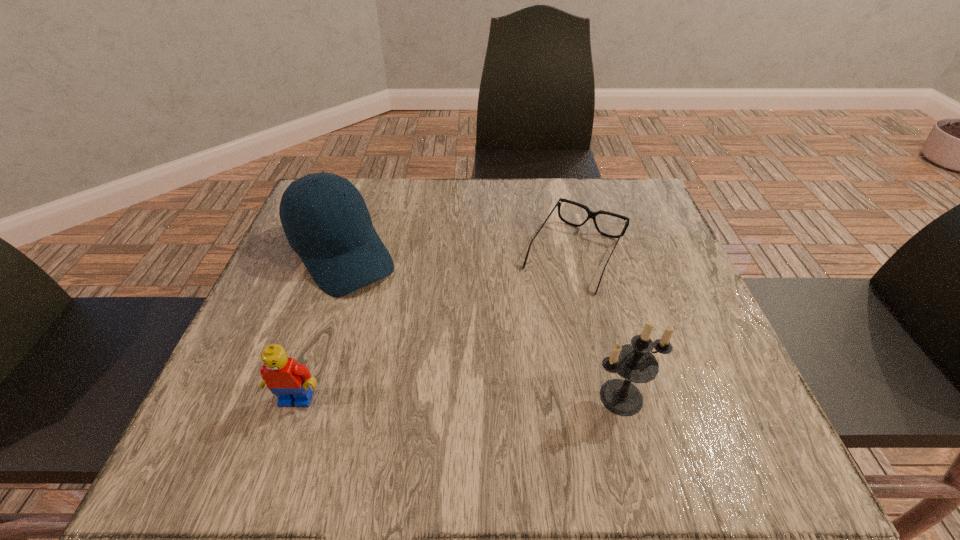
Locate an element on the screen. This screenshot has height=540, width=960. the third tallest object is located at coordinates (288, 380).

Image resolution: width=960 pixels, height=540 pixels. In order to click on candle holder in this screenshot , I will do `click(635, 362)`.

The image size is (960, 540). In order to click on spectacles in this screenshot , I will do `click(591, 214)`.

I want to click on baseball cap, so click(335, 239).

Find the location of a particular element. The height and width of the screenshot is (540, 960). vacant space situated on the left of the candle holder is located at coordinates (356, 397).

Where is `vacant area situated with the lenses facing outward on the spectacles`? The width and height of the screenshot is (960, 540). vacant area situated with the lenses facing outward on the spectacles is located at coordinates (538, 320).

The width and height of the screenshot is (960, 540). Find the location of `free region located with the lenses facing outward on the spectacles`. free region located with the lenses facing outward on the spectacles is located at coordinates (520, 348).

Where is `vacant point located with the lenses facing outward on the spectacles`? This screenshot has height=540, width=960. vacant point located with the lenses facing outward on the spectacles is located at coordinates (516, 356).

Locate an element on the screen. The height and width of the screenshot is (540, 960). free space located 0.100m on the front-facing side of the baseball cap is located at coordinates coord(388,319).

Locate an element on the screen. free location located 0.120m on the front-facing side of the baseball cap is located at coordinates (393, 325).